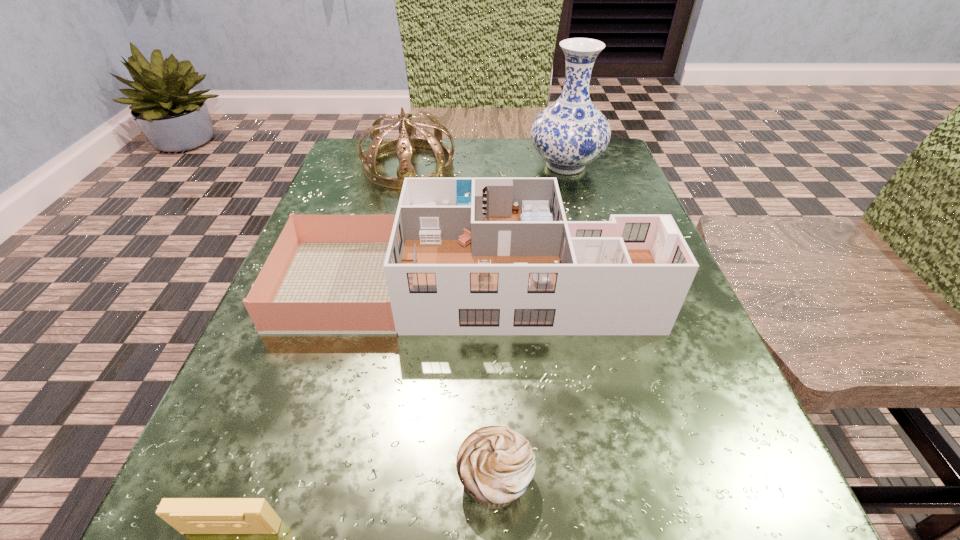
What are the coordinates of `free space between the third nearest object and the videotape` in the screenshot? It's located at (348, 406).

I want to click on free space between the nearest object and the third nearest object, so click(348, 406).

What are the coordinates of `blank region between the videotape and the tiara` in the screenshot? It's located at (321, 347).

You are a GUI agent. You are given a task and a screenshot of the screen. Output one action in this format:
    pyautogui.click(x=<x>, y=<y>)
    Task: Click on the object that is the third closest to the dollhouse
    This screenshot has height=540, width=960.
    Given the screenshot: What is the action you would take?
    pyautogui.click(x=570, y=133)

The height and width of the screenshot is (540, 960). I want to click on object that is the closest to the muffin, so click(466, 256).

Image resolution: width=960 pixels, height=540 pixels. Find the location of `vacant point that satisfies the following two spatial constraints: 1. at the front door of the dollhouse; 2. at the front of the videotape with spools`. vacant point that satisfies the following two spatial constraints: 1. at the front door of the dollhouse; 2. at the front of the videotape with spools is located at coordinates click(x=457, y=528).

Find the location of a particular element. Image resolution: width=960 pixels, height=540 pixels. free space that satisfies the following two spatial constraints: 1. at the front door of the dollhouse; 2. on the right side of the muffin is located at coordinates (459, 478).

The width and height of the screenshot is (960, 540). I want to click on free region that satisfies the following two spatial constraints: 1. at the front door of the second nearest object; 2. on the left side of the dollhouse, so click(x=459, y=478).

The height and width of the screenshot is (540, 960). What are the coordinates of `free location that satisfies the following two spatial constraints: 1. at the front door of the muffin; 2. on the left side of the dollhouse` in the screenshot? It's located at (459, 478).

Locate an element on the screen. vacant space that satisfies the following two spatial constraints: 1. at the front door of the muffin; 2. on the right side of the dollhouse is located at coordinates (459, 478).